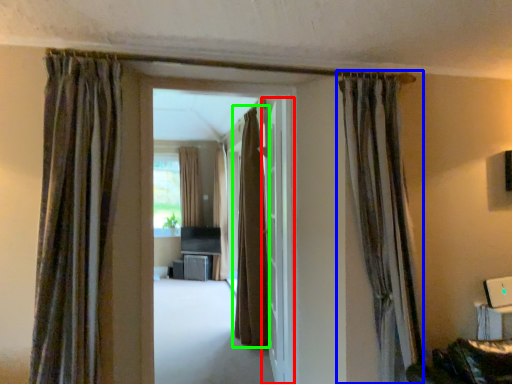
Question: Which is farther away from door (highlighted by a red box)? curtain (highlighted by a blue box) or curtain (highlighted by a green box)?

Choices:
 (A) curtain
 (B) curtain

Answer: (A)